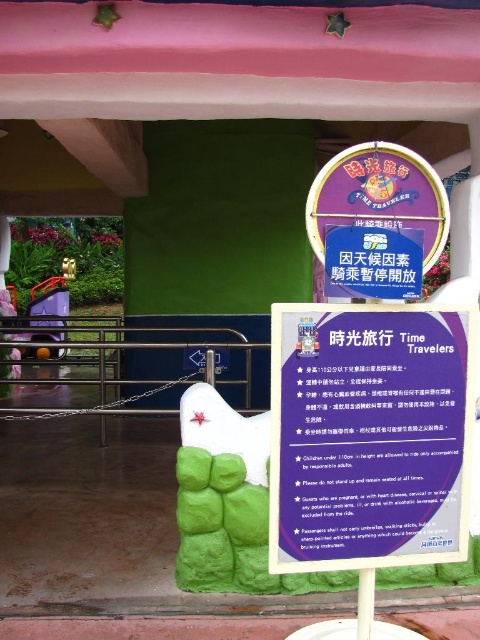
Question: Which object is farther from the camera taking this photo?

Choices:
 (A) purple glossy sign at center
 (B) purple paper sign at center

Answer: (A)

Question: Can you confirm if purple paper sign at center is positioned below purple glossy sign at center?

Choices:
 (A) yes
 (B) no

Answer: (A)

Question: Which object is closer to the camera taking this photo?

Choices:
 (A) purple paper sign at center
 (B) purple glossy sign at center

Answer: (A)

Question: Can you confirm if purple paper sign at center is positioned below purple glossy sign at center?

Choices:
 (A) no
 (B) yes

Answer: (B)

Question: Is purple paper sign at center smaller than purple glossy sign at center?

Choices:
 (A) no
 (B) yes

Answer: (A)